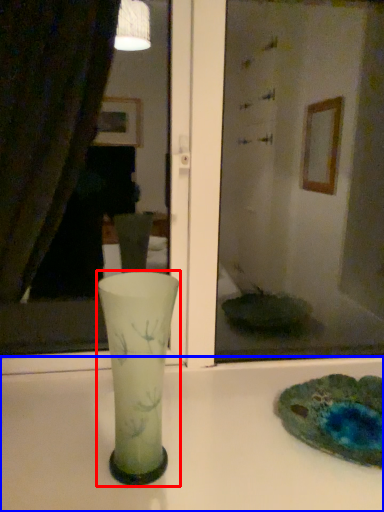
Question: Which object is further to the camera taking this photo, vase (highlighted by a red box) or counter top (highlighted by a blue box)?

Choices:
 (A) vase
 (B) counter top

Answer: (A)